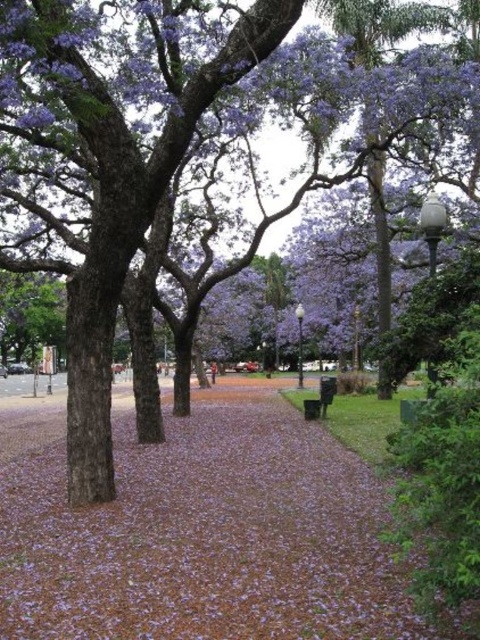
Is purple matte petals at center to the left of black plastic bench at center from the viewer's perspective?

Indeed, purple matte petals at center is positioned on the left side of black plastic bench at center.

Is point (164, 492) behind point (322, 394)?

No, (164, 492) is closer to viewer.

This screenshot has width=480, height=640. In order to click on purple matte petals at center in this screenshot , I will do `click(197, 531)`.